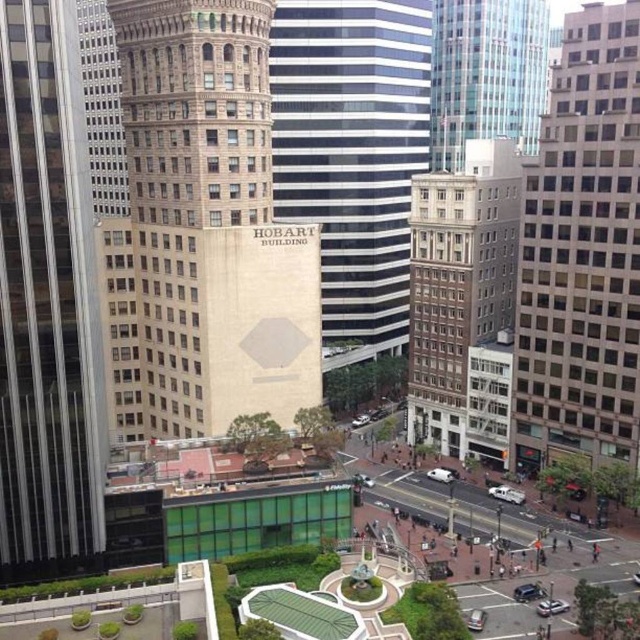
You are standing in the plaza and want to reach the base of the Hobart Building. You see two points marked on the ground ahead of you. One is at point (592, 428) and the other is at point (376, 180). Which point is closer to you as you face the direction of the Hobart Building?

Point (592, 428) is closer to the viewer than point (376, 180).

You are a city planner assessing the urban layout. You need to determine if the beige glass building at right can be expanded to match the width of the black and white striped building at center. Based on the current spatial configuration, is this expansion feasible without altering the existing structures?

The beige glass building at right is currently narrower than the black and white striped building at center. However, expanding it to match the width would require space that is already occupied by other structures or public areas, making the expansion infeasible without altering existing structures.

Based on the scene description and the provided coordinates, which object corresponds to the point labeled as point (48, 304)?

The point (48, 304) corresponds to the glassy steel skyscraper at center as described in the scene.